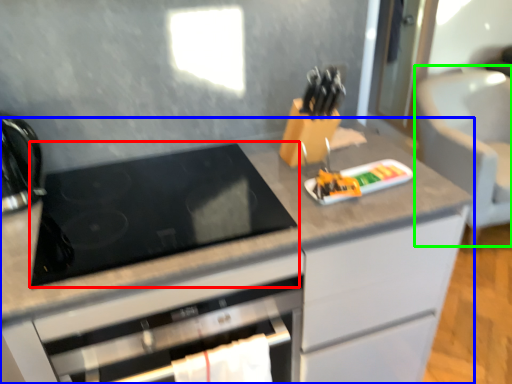
Question: Considering the real-world distances, which object is closest to gas stove (highlighted by a red box)? cabinetry (highlighted by a blue box) or armchair (highlighted by a green box).

Choices:
 (A) cabinetry
 (B) armchair

Answer: (A)